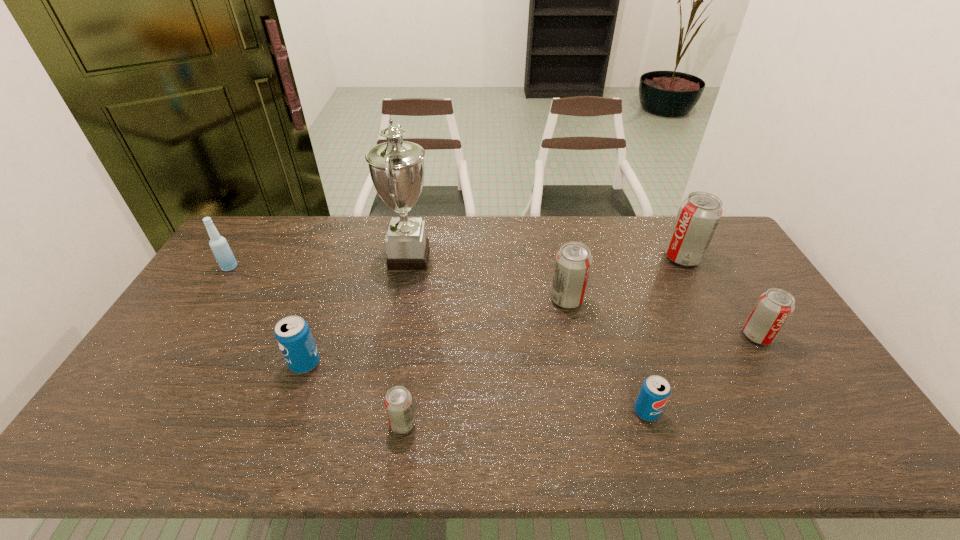
Where is `trophy cup`? The height and width of the screenshot is (540, 960). trophy cup is located at coordinates (396, 167).

I want to click on the farthest gray soda can, so click(699, 214).

This screenshot has height=540, width=960. Identify the location of the biggest gray soda can. (699, 214).

Find the location of a particular element. bottle is located at coordinates (219, 246).

I want to click on the fourth soda can from right to left, so click(x=573, y=263).

Where is `the third gray soda can from right to left`? the third gray soda can from right to left is located at coordinates (573, 263).

Identify the location of the second nearest gray soda can. (773, 309).

The image size is (960, 540). In order to click on the third farthest soda can in this screenshot , I will do `click(773, 309)`.

Identify the location of the left blue soda can. This screenshot has width=960, height=540. [x=292, y=333].

Locate an element on the screen. the sixth farthest object is located at coordinates (292, 333).